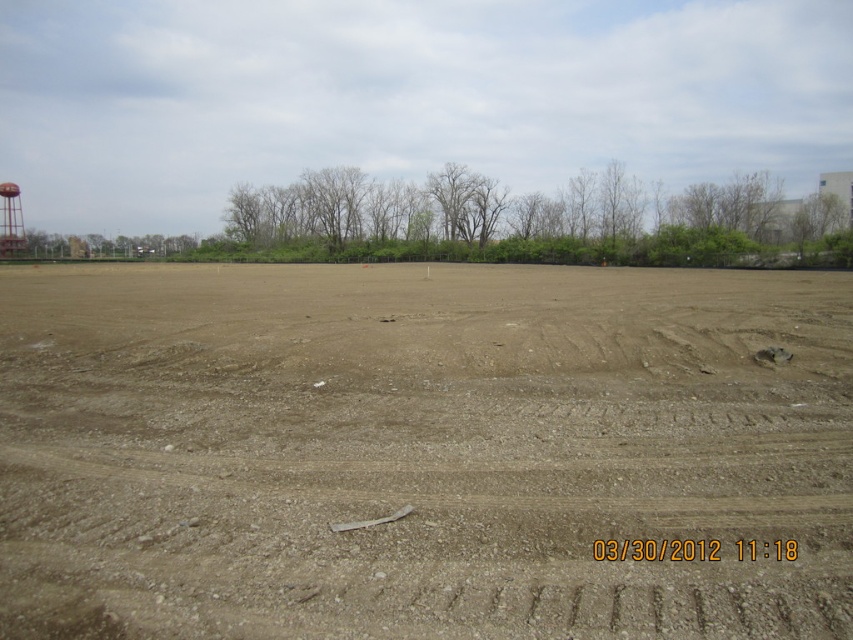
You are a delivery truck driver who needs to transport a large cargo container that requires a path at least 110 meters long between the brown sandy dirt at center and the metallic water tower at left. Can you safely drive through this path?

The distance between the brown sandy dirt at center and the metallic water tower at left is 109.37 meters, which is slightly shorter than the required 110 meters. Therefore, the path is not long enough to safely accommodate the cargo container.

You are standing at the origin point in the barren area. There is a point marked at coordinates point (519,216). What is located at that point?

The point (519,216) marks the location of the green leafy trees at center.